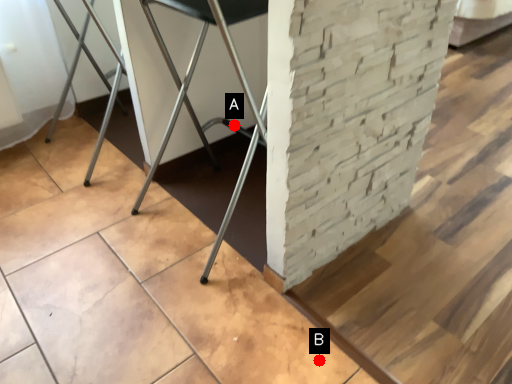
Question: Two points are circled on the image, labeled by A and B beside each circle. Which point is farther to the camera?

Choices:
 (A) A is further
 (B) B is further

Answer: (A)